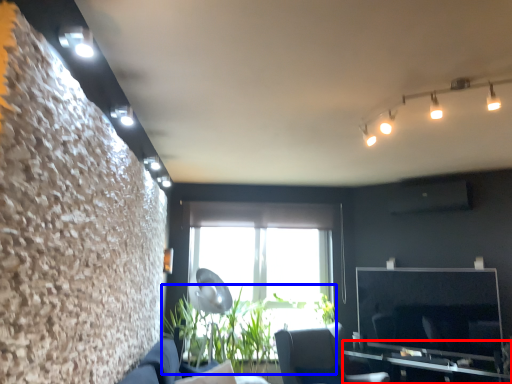
Question: Which object is closer to the camera taking this photo, table (highlighted by a red box) or plant (highlighted by a blue box)?

Choices:
 (A) table
 (B) plant

Answer: (A)